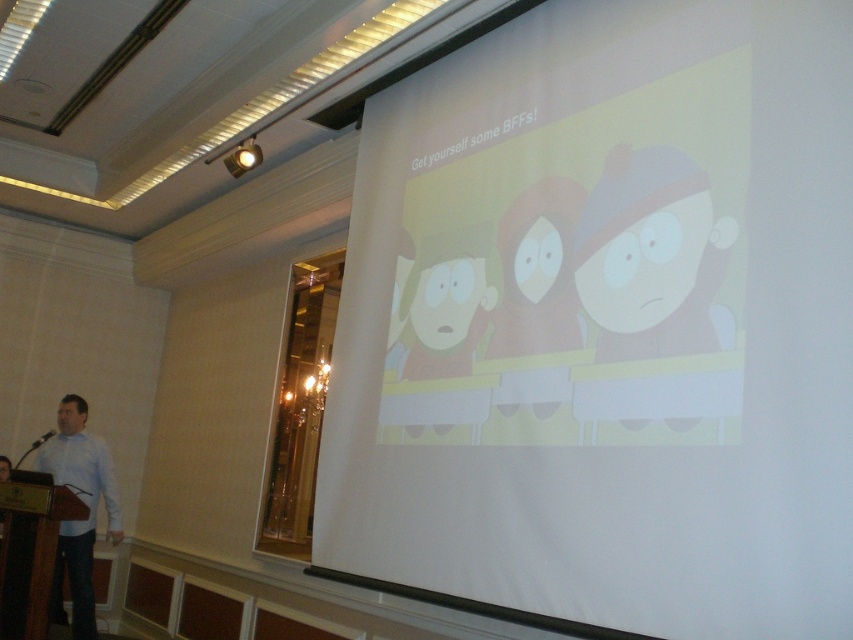
You are attending a presentation and notice two men in white shirts on the left side of the room. The first man is wearing a white shirt at left, and the second is wearing a white matte shirt at left. Which man is taller?

The white shirt at left is taller than the white matte shirt at left according to the description.

You are attending a presentation in the conference hall and notice a person wearing a white shirt at left. Where exactly is this person positioned in relation to the podium?

The white shirt at left is located at point coordinates 0.787 along the horizontal axis and 0.100 along the vertical axis relative to the podium.